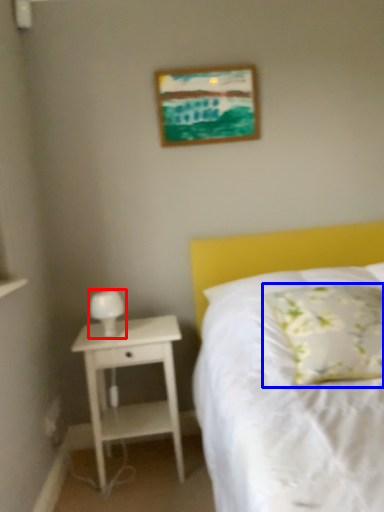
Question: Which object is closer to the camera taking this photo, bedside lamp (highlighted by a red box) or pillow (highlighted by a blue box)?

Choices:
 (A) bedside lamp
 (B) pillow

Answer: (B)